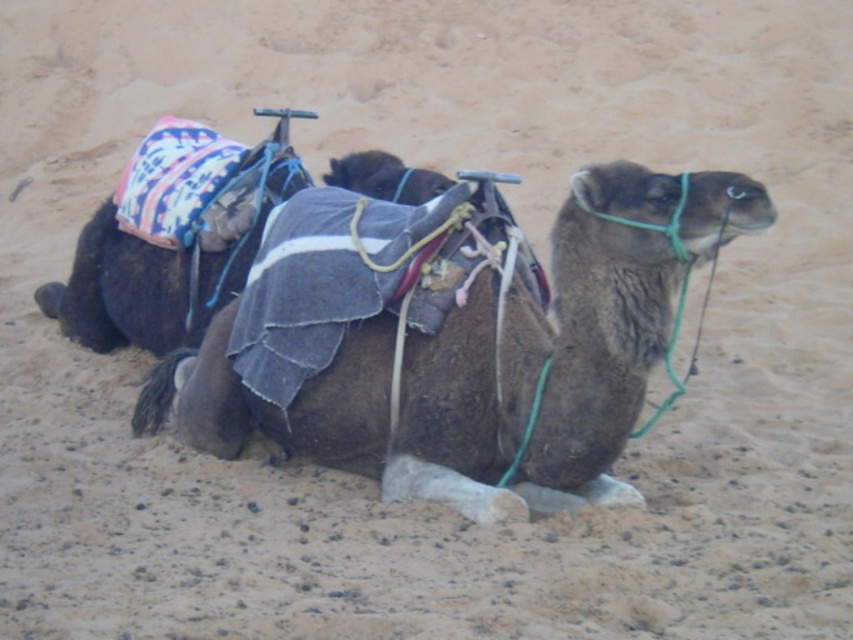
Question: Which point is closer to the camera?

Choices:
 (A) (416, 435)
 (B) (202, 324)

Answer: (A)

Question: Which point appears farthest from the camera in this image?

Choices:
 (A) (202, 273)
 (B) (625, 189)

Answer: (A)

Question: Which object is farther from the camera taking this photo?

Choices:
 (A) dark brown fabric camel at center
 (B) brown fabric camel at center

Answer: (A)

Question: Is brown fabric camel at center to the left of dark brown fabric camel at center from the viewer's perspective?

Choices:
 (A) no
 (B) yes

Answer: (A)

Question: Where is brown fabric camel at center located in relation to dark brown fabric camel at center in the image?

Choices:
 (A) left
 (B) right

Answer: (B)

Question: Can you confirm if brown fabric camel at center is positioned to the left of dark brown fabric camel at center?

Choices:
 (A) no
 (B) yes

Answer: (A)